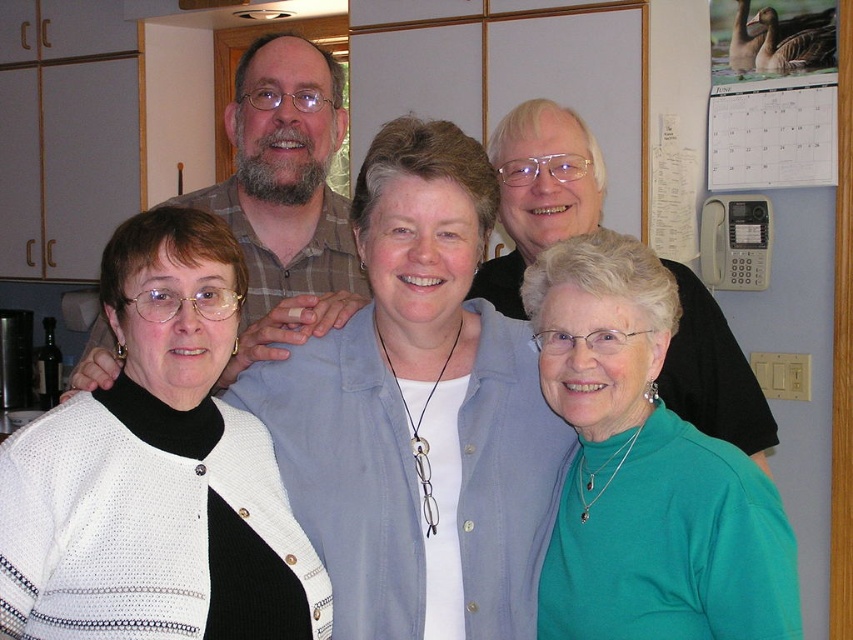
Question: Does light blue shirt at center have a smaller size compared to teal matte shirt at center?

Choices:
 (A) no
 (B) yes

Answer: (A)

Question: Considering the real-world distances, which object is closest to the teal matte shirt at center?

Choices:
 (A) plaid shirt at center
 (B) white knitted cardigan at left

Answer: (B)

Question: From the image, what is the correct spatial relationship of teal matte shirt at center in relation to plaid shirt at center?

Choices:
 (A) below
 (B) above

Answer: (A)

Question: Is white knitted cardigan at left to the right of teal matte shirt at center from the viewer's perspective?

Choices:
 (A) no
 (B) yes

Answer: (A)

Question: Which of the following is the closest to the observer?

Choices:
 (A) white knitted cardigan at left
 (B) light blue shirt at center
 (C) plaid shirt at center
 (D) teal matte shirt at center

Answer: (A)

Question: Among these objects, which one is farthest from the camera?

Choices:
 (A) teal matte shirt at center
 (B) white knitted cardigan at left

Answer: (A)